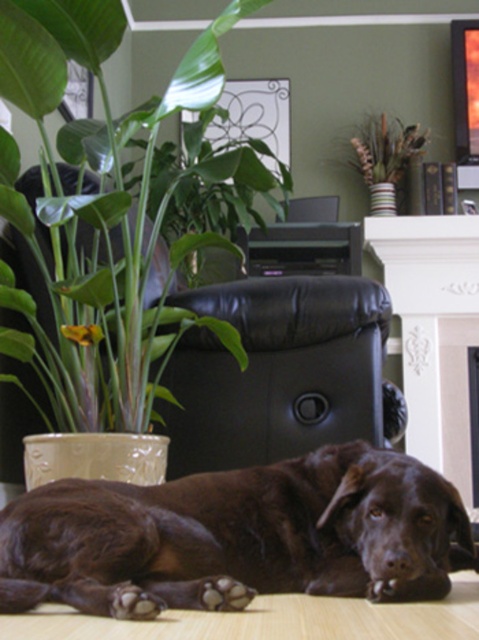
From the picture: Please provide the coordinates of the brown furry dog at lower center in the image. The coordinates should be in the format of a point with two decimal places, like this example format point 0.5, 0.5. Please do not add any other information besides the coordinate point.

The coordinates of the brown furry dog at lower center are point (238, 536).

You are a visitor in this room and want to know which object is shorter between the green leafy plant at left and the white painted wood fireplace at upper center. Can you tell me?

The green leafy plant at left is not as tall as the white painted wood fireplace at upper center, so the green leafy plant at left is shorter.

You are a photographer standing at a certain distance from the brown furry dog at lower center. You want to take a closeup shot of the dog without using a zoom lens. Given that the camera you have can only focus clearly at 3 feet, should you move closer or farther away from the dog?

The brown furry dog at lower center is currently 4.00 feet away from the camera. Since the camera can only focus clearly at 3 feet, you need to move closer to the dog to achieve a clear closeup shot.